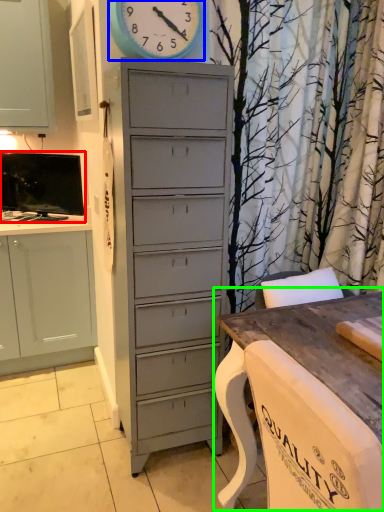
Question: Based on their relative distances, which object is nearer to television (highlighted by a red box)? Choose from clock (highlighted by a blue box) and table (highlighted by a green box).

Choices:
 (A) clock
 (B) table

Answer: (A)